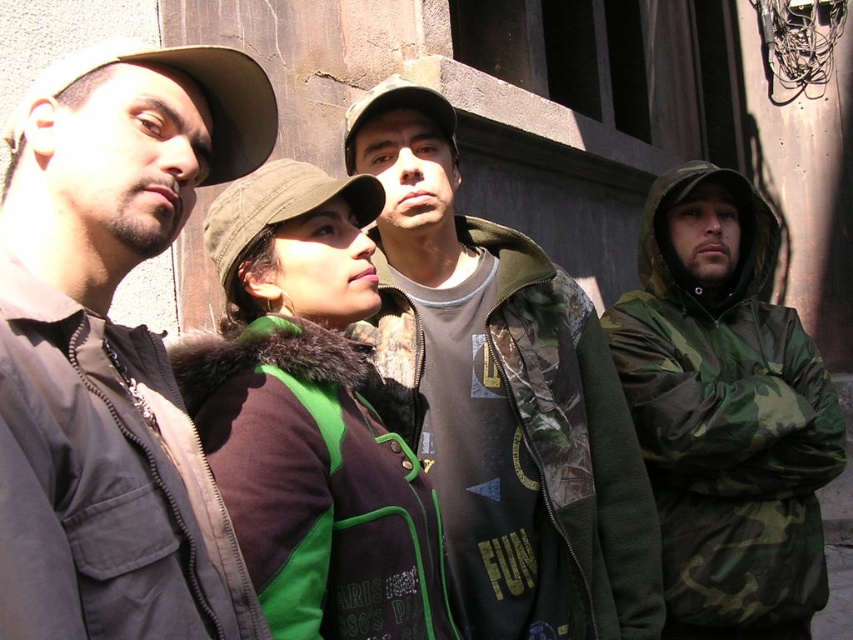
You are standing at the origin point of the coordinate system. You see the matte brown jacket at left. What are its coordinates?

The coordinates of the matte brown jacket at left are at point [112,349].

You are a photographer standing in front of the weathered stone wall. You want to take a photo of the matte brown jacket at left and the brown fabric baseball cap at upper left. The camera you are using has a minimum focus distance of 5 feet. Can you capture both objects clearly in focus without moving the camera or the subjects?

The matte brown jacket at left and brown fabric baseball cap at upper left are 7.92 feet apart. Since the minimum focus distance is 5 feet, the camera can focus on both objects as they are within the required distance range.

You are a photographer trying to capture a group photo of the camo fabric jacket at right and the green fabric baseball cap at center. Since you want to ensure both are in frame, which direction should you position yourself relative to the subjects?

You should position yourself to the left of the subjects because the camo fabric jacket at right is on the right side of the green fabric baseball cap at center, so placing yourself to the left would allow both to be in frame.